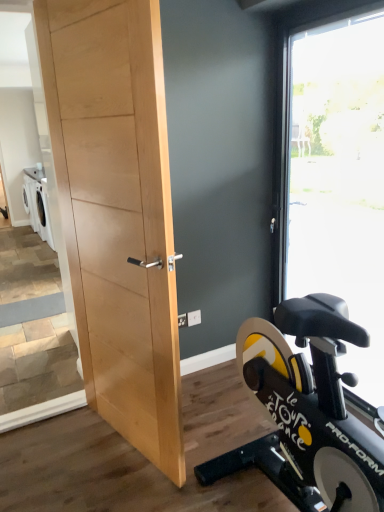
Image resolution: width=384 pixels, height=512 pixels. In order to click on free space in front of natural wood door at center in this screenshot , I will do `click(114, 485)`.